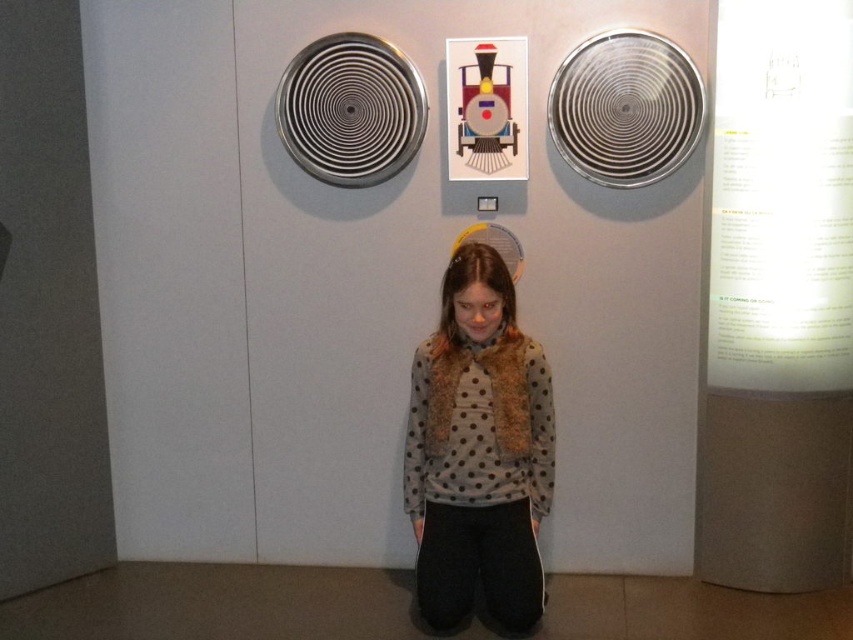
Identify the location of metallic spiral at upper center. (350, 109).

Does metallic spiral at upper center have a greater width compared to metallic train at upper center?

Yes.

Describe the element at coordinates (350, 109) in the screenshot. I see `metallic spiral at upper center` at that location.

The image size is (853, 640). I want to click on metallic spiral at upper center, so click(350, 109).

Is polka dot sweater at center above metallic spiral fan at upper right?

Incorrect, polka dot sweater at center is not positioned above metallic spiral fan at upper right.

Between point (517, 481) and point (585, 60), which one is positioned behind?

Positioned behind is point (585, 60).

Where is `polka dot sweater at center`? polka dot sweater at center is located at coordinates (479, 451).

Which is behind, point (440, 422) or point (344, 161)?

Positioned behind is point (344, 161).

Who is higher up, polka dot sweater at center or metallic spiral at upper center?

Positioned higher is metallic spiral at upper center.

This screenshot has height=640, width=853. What do you see at coordinates (479, 451) in the screenshot?
I see `polka dot sweater at center` at bounding box center [479, 451].

This screenshot has height=640, width=853. Find the location of `polka dot sweater at center`. polka dot sweater at center is located at coordinates (479, 451).